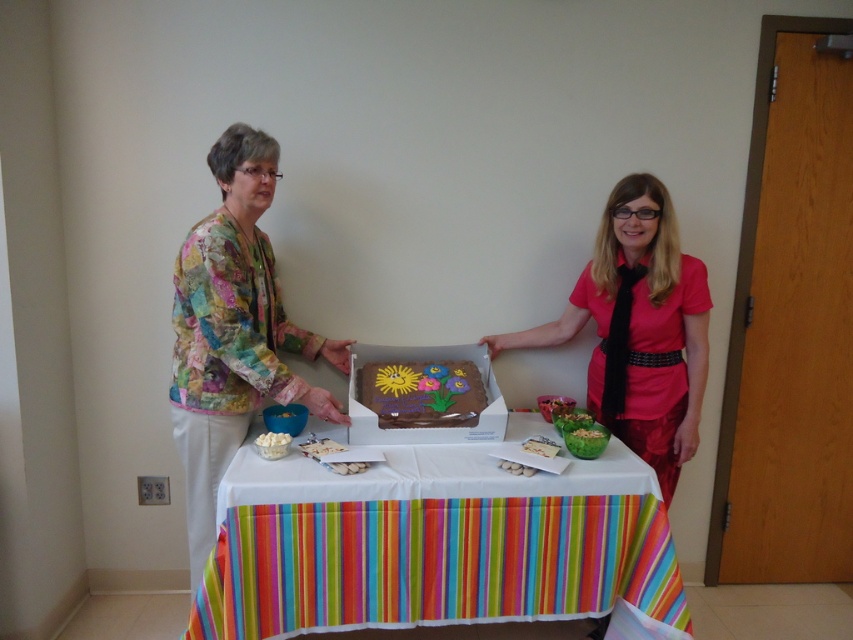
Question: Which point is farther from the camera taking this photo?

Choices:
 (A) (430, 376)
 (B) (593, 424)
 (C) (563, 417)
 (D) (351, 604)

Answer: (A)

Question: Estimate the real-world distances between objects in this image. Which object is farther from the green leafy vegetable at center?

Choices:
 (A) multicolored striped tablecloth at center
 (B) matte pink shirt at center
 (C) green plastic bowl at center
 (D) patchwork fabric blouse at left

Answer: (D)

Question: Which point is closer to the camera?

Choices:
 (A) white creamy popcorn at lower left
 (B) green plastic bowl at center
 (C) multicolored striped tablecloth at center

Answer: (C)

Question: Is multicolored striped tablecloth at center bigger than green leafy vegetable at center?

Choices:
 (A) no
 (B) yes

Answer: (B)

Question: Is multicolored striped tablecloth at center above patchwork fabric blouse at left?

Choices:
 (A) no
 (B) yes

Answer: (A)

Question: Can you confirm if patchwork fabric blouse at left is smaller than green leafy vegetable at center?

Choices:
 (A) yes
 (B) no

Answer: (B)